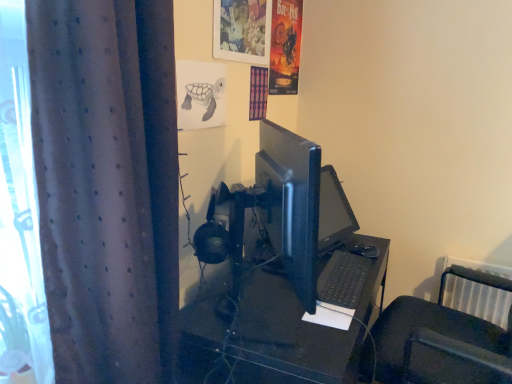
The image size is (512, 384). What do you see at coordinates (343, 279) in the screenshot?
I see `black plastic keyboard at lower center` at bounding box center [343, 279].

In order to face black plastic desk at center, should I rotate leftwards or rightwards?

Turn right by 5.849 degrees to look at black plastic desk at center.

Find the location of a particular element. This screenshot has width=512, height=384. black plastic desk at center is located at coordinates (288, 339).

The image size is (512, 384). What do you see at coordinates (285, 46) in the screenshot?
I see `vibrant paper poster at upper right, which ranks as the first poster page in right-to-left order` at bounding box center [285, 46].

You are a GUI agent. You are given a task and a screenshot of the screen. Output one action in this format:
    pyautogui.click(x=<x>, y=<y>)
    Task: Click on the gray pencil drawing of turtle at upper center, which appears as the 1th poster page when viewed from the front
    The height and width of the screenshot is (384, 512).
    Given the screenshot: What is the action you would take?
    pyautogui.click(x=200, y=94)

In the scene shown: Which point is more forward, (292,81) or (323,355)?

The point (323,355) is in front.

Which object is further away from the camera taking this photo, vibrant paper poster at upper right, the 2th poster page positioned from the bottom, or black plastic desk at center?

Positioned behind is vibrant paper poster at upper right, the 2th poster page positioned from the bottom.

Is vibrant paper poster at upper right, which appears as the first poster page when viewed from the back, far from black plastic desk at center?

vibrant paper poster at upper right, which appears as the first poster page when viewed from the back, is actually quite close to black plastic desk at center.

Is vibrant paper poster at upper right, which ranks as the first poster page in right-to-left order, wider or thinner than black plastic desk at center?

In the image, vibrant paper poster at upper right, which ranks as the first poster page in right-to-left order, appears to be more narrow than black plastic desk at center.

Which object is positioned more to the left, dark grey textured curtain at left or gray pencil drawing of turtle at upper center, which appears as the 1th poster page when viewed from the front?

dark grey textured curtain at left is more to the left.

From the image's perspective, who appears lower, dark grey textured curtain at left or gray pencil drawing of turtle at upper center, positioned as the 1th poster page in bottom-to-top order?

From the image's view, dark grey textured curtain at left is below.

Would you say dark grey textured curtain at left contains gray pencil drawing of turtle at upper center, placed as the 2th poster page when sorted from top to bottom?

No, gray pencil drawing of turtle at upper center, placed as the 2th poster page when sorted from top to bottom, is not surrounded by dark grey textured curtain at left.

From a real-world perspective, between dark grey textured curtain at left and gray pencil drawing of turtle at upper center, positioned as the 1th poster page in bottom-to-top order, who is vertically higher?

gray pencil drawing of turtle at upper center, positioned as the 1th poster page in bottom-to-top order, from a real-world perspective.

Can you confirm if vibrant paper poster at upper right, which appears as the 2th poster page when viewed from the front, is smaller than dark grey textured curtain at left?

Correct, vibrant paper poster at upper right, which appears as the 2th poster page when viewed from the front, occupies less space than dark grey textured curtain at left.

Is vibrant paper poster at upper right, which ranks as the first poster page in right-to-left order, directly adjacent to dark grey textured curtain at left?

vibrant paper poster at upper right, which ranks as the first poster page in right-to-left order, and dark grey textured curtain at left are not in contact.

Is vibrant paper poster at upper right, the 1th poster page positioned from the top, looking in the opposite direction of dark grey textured curtain at left?

No, vibrant paper poster at upper right, the 1th poster page positioned from the top, is not facing the opposite direction of dark grey textured curtain at left.

Looking at this image, from a real-world perspective, between vibrant paper poster at upper right, which appears as the 2th poster page when viewed from the front, and dark grey textured curtain at left, who is vertically higher?

vibrant paper poster at upper right, which appears as the 2th poster page when viewed from the front.

In the scene shown: Is gray pencil drawing of turtle at upper center, which appears as the 1th poster page when viewed from the front, taller than matte plastic picture frame at upper center?

No, gray pencil drawing of turtle at upper center, which appears as the 1th poster page when viewed from the front, is not taller than matte plastic picture frame at upper center.

Which is more to the left, gray pencil drawing of turtle at upper center, positioned as the 1th poster page in bottom-to-top order, or matte plastic picture frame at upper center?

gray pencil drawing of turtle at upper center, positioned as the 1th poster page in bottom-to-top order, is more to the left.

Is gray pencil drawing of turtle at upper center, positioned as the 1th poster page in left-to-right order, looking in the opposite direction of matte plastic picture frame at upper center?

gray pencil drawing of turtle at upper center, positioned as the 1th poster page in left-to-right order, does not have its back to matte plastic picture frame at upper center.

Considering the positions of point (188, 71) and point (253, 51), is point (188, 71) closer or farther from the camera than point (253, 51)?

Point (188, 71).

Looking at this image, between matte plastic picture frame at upper center and black plastic desk at center, which one is positioned in front?

black plastic desk at center is closer to the camera.

Is matte plastic picture frame at upper center surrounding black plastic desk at center?

No.

Who is shorter, matte plastic picture frame at upper center or black plastic desk at center?

matte plastic picture frame at upper center.

From a real-world perspective, who is located lower, matte plastic picture frame at upper center or vibrant paper poster at upper right, which ranks as the first poster page in right-to-left order?

From a 3D spatial view, vibrant paper poster at upper right, which ranks as the first poster page in right-to-left order, is below.

Between matte plastic picture frame at upper center and vibrant paper poster at upper right, which appears as the 2th poster page when viewed from the front, which one has smaller size?

matte plastic picture frame at upper center is smaller.

Considering their positions, is matte plastic picture frame at upper center located in front of or behind vibrant paper poster at upper right, the second poster page when ordered from left to right?

matte plastic picture frame at upper center is in front of vibrant paper poster at upper right, the second poster page when ordered from left to right.

Does point (221, 38) come farther from viewer compared to point (280, 50)?

No, (221, 38) is in front of (280, 50).

Does black plastic desk at center have a smaller size compared to black plastic keyboard at lower center?

Actually, black plastic desk at center might be larger than black plastic keyboard at lower center.

You are a GUI agent. You are given a task and a screenshot of the screen. Output one action in this format:
    pyautogui.click(x=<x>, y=<y>)
    Task: Click on the desk below the black plastic keyboard at lower center (from a real-world perspective)
    
    Given the screenshot: What is the action you would take?
    pyautogui.click(x=288, y=339)

Is black plastic desk at center oriented away from black plastic keyboard at lower center?

No.

Is black plastic desk at center next to black plastic keyboard at lower center?

black plastic desk at center and black plastic keyboard at lower center are clearly separated.

Locate an element on the screen. The height and width of the screenshot is (384, 512). desk located underneath the vibrant paper poster at upper right, which ranks as the first poster page in right-to-left order (from a real-world perspective) is located at coordinates (288, 339).

Where is `curtain located in front of the gray pencil drawing of turtle at upper center, positioned as the 1th poster page in left-to-right order`? The image size is (512, 384). curtain located in front of the gray pencil drawing of turtle at upper center, positioned as the 1th poster page in left-to-right order is located at coordinates (106, 185).

Which object lies nearer to the anchor point matte plastic picture frame at upper center, black plastic desk at center or vibrant paper poster at upper right, the 2th poster page positioned from the bottom?

vibrant paper poster at upper right, the 2th poster page positioned from the bottom, lies closer to matte plastic picture frame at upper center than the other object.

Looking at the image, which one is located further to black plastic desk at center, vibrant paper poster at upper right, the second poster page when ordered from left to right, or matte plastic picture frame at upper center?

vibrant paper poster at upper right, the second poster page when ordered from left to right, lies further to black plastic desk at center than the other object.

Consider the image. When comparing their distances from matte plastic picture frame at upper center, does gray pencil drawing of turtle at upper center, positioned as the 1th poster page in bottom-to-top order, or black plastic desk at center seem further?

Based on the image, black plastic desk at center appears to be further to matte plastic picture frame at upper center.

Based on their spatial positions, is gray pencil drawing of turtle at upper center, positioned as the 1th poster page in left-to-right order, or matte plastic picture frame at upper center further from black plastic keyboard at lower center?

matte plastic picture frame at upper center is positioned further to the anchor black plastic keyboard at lower center.

When comparing their distances from black plastic desk at center, does black plastic keyboard at lower center or vibrant paper poster at upper right, the second poster page when ordered from left to right, seem closer?

Based on the image, black plastic keyboard at lower center appears to be nearer to black plastic desk at center.

Which object lies nearer to the anchor point matte plastic picture frame at upper center, satin black monitor at center or vibrant paper poster at upper right, which appears as the first poster page when viewed from the back?

Based on the image, vibrant paper poster at upper right, which appears as the first poster page when viewed from the back, appears to be nearer to matte plastic picture frame at upper center.

Considering their positions, is gray pencil drawing of turtle at upper center, which appears as the 1th poster page when viewed from the front, positioned further to matte plastic picture frame at upper center than vibrant paper poster at upper right, which ranks as the first poster page in right-to-left order?

vibrant paper poster at upper right, which ranks as the first poster page in right-to-left order.

Considering their positions, is dark grey textured curtain at left positioned further to matte plastic picture frame at upper center than black plastic keyboard at lower center?

Based on the image, black plastic keyboard at lower center appears to be further to matte plastic picture frame at upper center.

The width and height of the screenshot is (512, 384). In order to click on computer monitor between gray pencil drawing of turtle at upper center, which appears as the 2th poster page when viewed from the right, and black plastic desk at center vertically in this screenshot , I will do `click(293, 204)`.

This screenshot has width=512, height=384. Find the location of `computer keyboard between gray pencil drawing of turtle at upper center, which appears as the 1th poster page when viewed from the front, and black plastic desk at center, in the vertical direction`. computer keyboard between gray pencil drawing of turtle at upper center, which appears as the 1th poster page when viewed from the front, and black plastic desk at center, in the vertical direction is located at coordinates (343, 279).

You are a GUI agent. You are given a task and a screenshot of the screen. Output one action in this format:
    pyautogui.click(x=<x>, y=<y>)
    Task: Click on the curtain between vibrant paper poster at upper right, which ranks as the first poster page in right-to-left order, and black plastic desk at center from top to bottom
    The image size is (512, 384).
    Given the screenshot: What is the action you would take?
    pyautogui.click(x=106, y=185)

Find the location of a particular element. computer keyboard between vibrant paper poster at upper right, which ranks as the first poster page in right-to-left order, and black plastic desk at center, in the vertical direction is located at coordinates (343, 279).